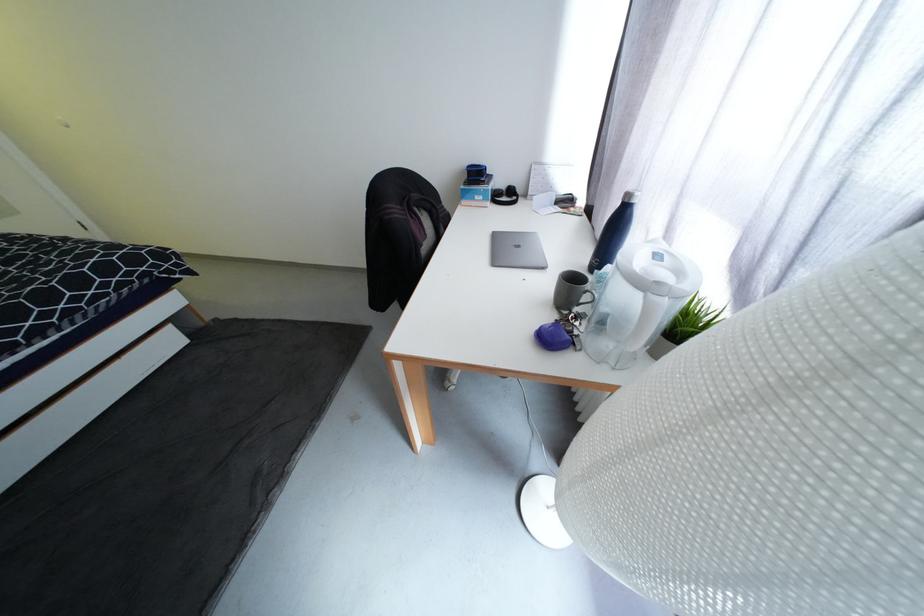
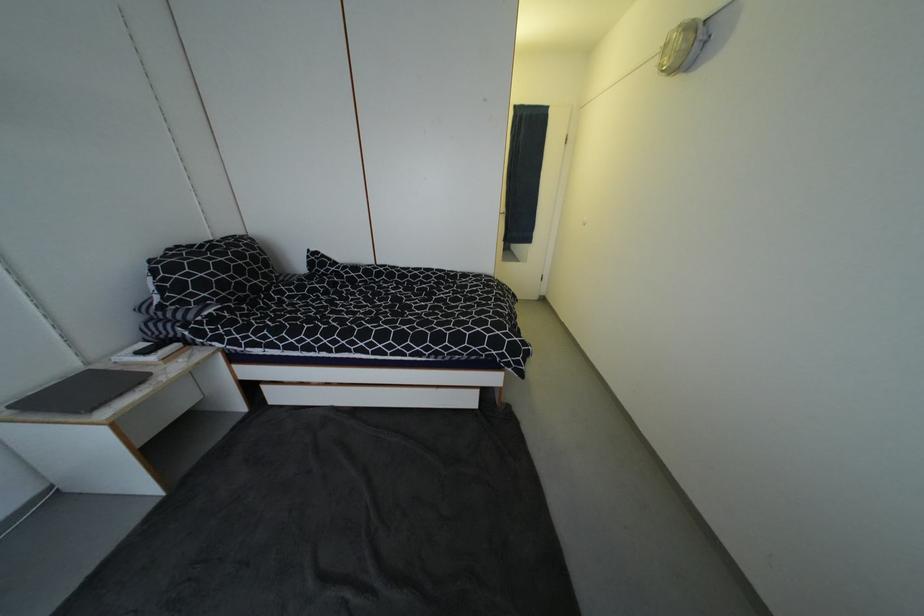
Question: Based on the continuous images, in which direction is the camera rotating? Reply with the corresponding letter.

Choices:
 (A) Left
 (B) Right
 (C) Up
 (D) Down

Answer: (A)